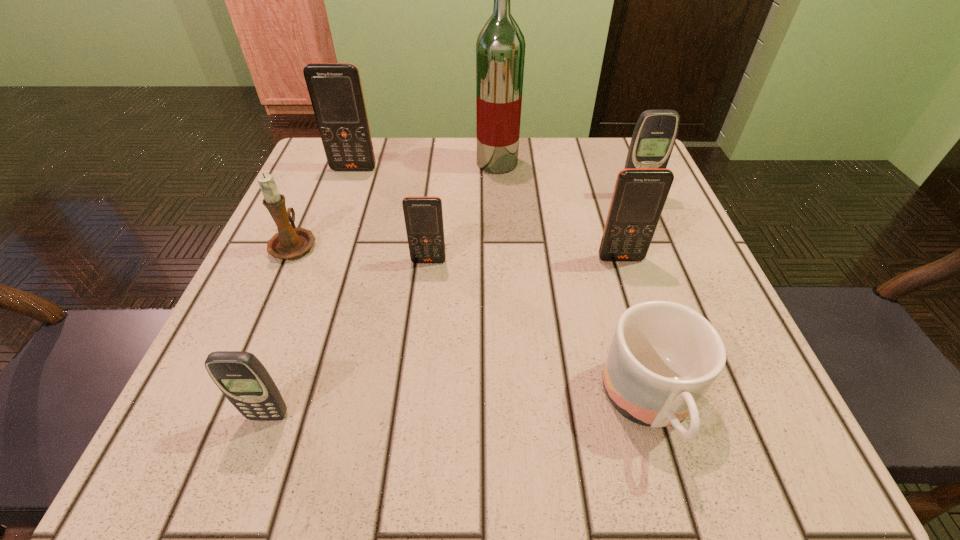
You are a GUI agent. You are given a task and a screenshot of the screen. Output one action in this format:
    pyautogui.click(x=<x>, y=<y>)
    Task: Click on the free region located 0.270m on the side of the candle holder with the handle
    Image resolution: width=960 pixels, height=540 pixels.
    Given the screenshot: What is the action you would take?
    coord(335,151)

Find the location of a particular element. vacant space situated on the screen of the second orange cellular telephone from right to left is located at coordinates (415, 382).

Where is `liquor that is at the far edge`? Image resolution: width=960 pixels, height=540 pixels. liquor that is at the far edge is located at coordinates (500, 48).

This screenshot has height=540, width=960. Identify the location of cellular telephone at the near edge. (242, 378).

Locate an element on the screen. The image size is (960, 540). mug that is at the near edge is located at coordinates (664, 356).

At what (x,y) coordinates should I click in order to perform the action: click on candle holder located in the left edge section of the desktop. Please return your answer as a coordinate pair (x, y). Looking at the image, I should click on point(290,242).

Where is `mug located at the right edge`? mug located at the right edge is located at coordinates (664, 356).

Image resolution: width=960 pixels, height=540 pixels. I want to click on object located at the far left corner, so [x=335, y=90].

Identify the location of object at the near left corner. (242, 378).

This screenshot has width=960, height=540. Find the location of `object located at the far right corner`. object located at the far right corner is located at coordinates (654, 136).